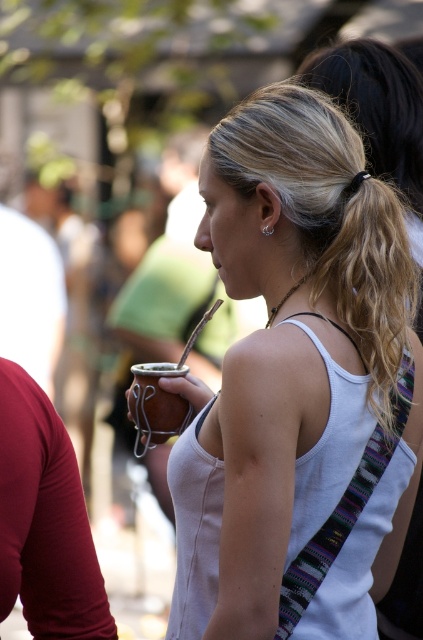
You are a photographer at the event and want to capture the woman holding the mate while ensuring her matte brown leather purse at center is visible in the frame. Based on its position, where should you position the camera relative to her?

The matte brown leather purse at center is located at point (299, 385), so you should position the camera slightly to the right and lower down to ensure the purse is in the frame while capturing the woman holding the mate.

You are a photographer standing at the edge of a crowded outdoor event. You notice a matte brown leather purse at center and a matte brown cup at center in the scene. Can you determine if the distance between them is sufficient for you to comfortably walk between them without stepping too close to either?

The matte brown leather purse at center is 3.17 meters from the matte brown cup at center. Since 3.17 meters is a considerable distance, you can comfortably walk between them without stepping too close to either object.

You are at a social gathering and need to place your matte brown leather purse at center and matte brown cup at center on a small table. Which object should you place first to ensure both fit on the table?

Since the matte brown leather purse at center is shorter in height than the matte brown cup at center, you should place the matte brown cup at center first to ensure both items can fit on the table.